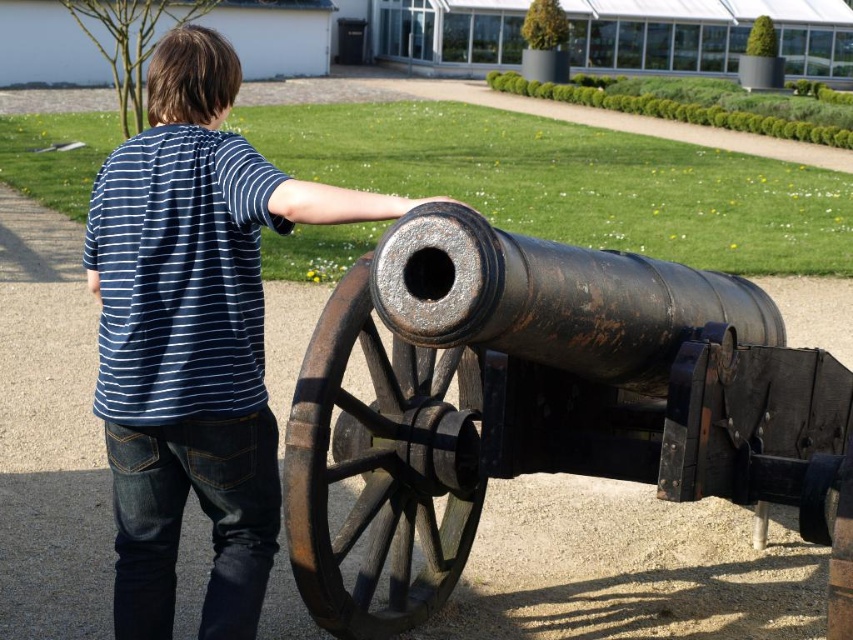
Who is more distant from viewer, [170,355] or [225,196]?

The point [170,355] is more distant.

Is point (375, 212) behind point (183, 209)?

No, it is in front of (183, 209).

This screenshot has height=640, width=853. I want to click on blue striped shirt at center, so click(193, 337).

Can you confirm if rusty metal cannon at center is taller than blue striped shirt at center?

In fact, rusty metal cannon at center may be shorter than blue striped shirt at center.

Does rusty metal cannon at center have a greater width compared to blue striped shirt at center?

Correct, the width of rusty metal cannon at center exceeds that of blue striped shirt at center.

Describe the element at coordinates (544, 404) in the screenshot. I see `rusty metal cannon at center` at that location.

Locate an element on the screen. The image size is (853, 640). rusty metal cannon at center is located at coordinates (544, 404).

Is point (519, 278) positioned in front of point (207, 234)?

Yes, point (519, 278) is closer to viewer.

Who is more distant from viewer, (337, 333) or (239, 188)?

Point (337, 333)

Who is more forward, (426, 236) or (196, 333)?

Point (426, 236) is more forward.

You are a GUI agent. You are given a task and a screenshot of the screen. Output one action in this format:
    pyautogui.click(x=<x>, y=<y>)
    Task: Click on the rusty metal cannon at center
    This screenshot has height=640, width=853.
    Given the screenshot: What is the action you would take?
    pyautogui.click(x=544, y=404)